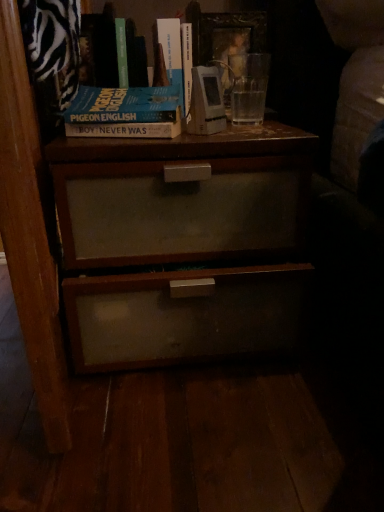
Question: Is hardcover book at upper center, the second book when ordered from right to left, looking in the opposite direction of blue matte book at upper center?

Choices:
 (A) yes
 (B) no

Answer: (B)

Question: From a real-world perspective, is hardcover book at upper center, arranged as the 1th book when viewed from the left, located higher than blue matte book at upper center?

Choices:
 (A) yes
 (B) no

Answer: (A)

Question: Considering the relative sizes of hardcover book at upper center, the second book when ordered from right to left, and blue matte book at upper center in the image provided, is hardcover book at upper center, the second book when ordered from right to left, wider than blue matte book at upper center?

Choices:
 (A) no
 (B) yes

Answer: (B)

Question: Is hardcover book at upper center, arranged as the 1th book when viewed from the left, taller than blue matte book at upper center?

Choices:
 (A) no
 (B) yes

Answer: (B)

Question: Is the position of hardcover book at upper center, the second book when ordered from right to left, more distant than that of blue matte book at upper center?

Choices:
 (A) yes
 (B) no

Answer: (A)

Question: From a real-world perspective, is hardcover book at upper center, arranged as the 1th book when viewed from the left, physically located above or below hardcover book at upper center, marked as the first book in a right-to-left arrangement?

Choices:
 (A) below
 (B) above

Answer: (B)

Question: Is hardcover book at upper center, arranged as the 1th book when viewed from the left, situated inside hardcover book at upper center, marked as the first book in a right-to-left arrangement, or outside?

Choices:
 (A) outside
 (B) inside

Answer: (A)

Question: Relative to hardcover book at upper center, marked as the first book in a right-to-left arrangement, is hardcover book at upper center, arranged as the 1th book when viewed from the left, in front or behind?

Choices:
 (A) behind
 (B) front

Answer: (B)

Question: Would you say hardcover book at upper center, arranged as the 1th book when viewed from the left, is to the left or to the right of hardcover book at upper center, the 2th book viewed from the left, in the picture?

Choices:
 (A) right
 (B) left

Answer: (B)

Question: Which is correct: hardcover book at upper center, arranged as the 1th book when viewed from the left, is inside blue matte book at upper center, or outside of it?

Choices:
 (A) outside
 (B) inside

Answer: (A)

Question: Does point (168, 61) appear closer or farther from the camera than point (137, 88)?

Choices:
 (A) closer
 (B) farther

Answer: (B)

Question: From a real-world perspective, is hardcover book at upper center, the second book when ordered from right to left, physically located above or below blue matte book at upper center?

Choices:
 (A) below
 (B) above

Answer: (B)

Question: Relative to blue matte book at upper center, is hardcover book at upper center, arranged as the 1th book when viewed from the left, in front or behind?

Choices:
 (A) front
 (B) behind

Answer: (B)

Question: Is blue matte book at upper center wider or thinner than hardcover book at upper center, marked as the first book in a right-to-left arrangement?

Choices:
 (A) wide
 (B) thin

Answer: (B)

Question: From the image's perspective, is blue matte book at upper center positioned above or below hardcover book at upper center, marked as the first book in a right-to-left arrangement?

Choices:
 (A) above
 (B) below

Answer: (B)